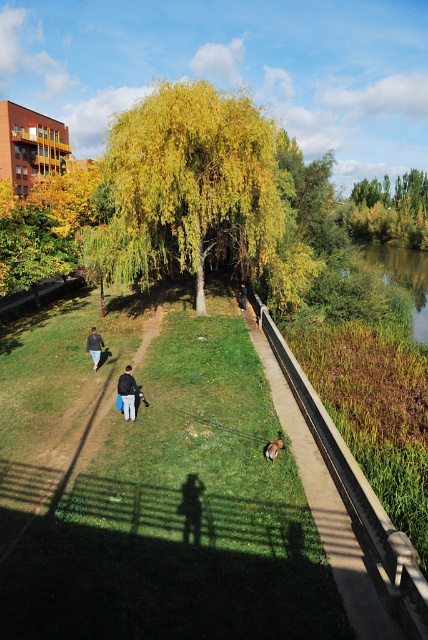
Is point (143, 205) positioned before point (243, 284)?

Yes, it is in front of point (243, 284).

Which of these two, yellow-green leaves at center or dark gray fabric at center, stands shorter?

dark gray fabric at center

The image size is (428, 640). What do you see at coordinates (189, 186) in the screenshot? I see `yellow-green leaves at center` at bounding box center [189, 186].

Find the location of a particular element. This screenshot has height=640, width=428. yellow-green leaves at center is located at coordinates (189, 186).

Image resolution: width=428 pixels, height=640 pixels. Identify the location of green leafy tree at upper center. (389, 209).

Does point (413, 205) lie behind point (98, 352)?

Yes, point (413, 205) is behind point (98, 352).

This screenshot has width=428, height=640. Find the location of `green leafy tree at upper center`. green leafy tree at upper center is located at coordinates [x=389, y=209].

Does point (83, 342) come closer to viewer compared to point (95, 353)?

No, (83, 342) is behind (95, 353).

Can you confirm if green grass at center is positioned to the left of dark blue jeans at lower left?

No, green grass at center is not to the left of dark blue jeans at lower left.

The image size is (428, 640). Identify the location of green grass at center. pos(68,419).